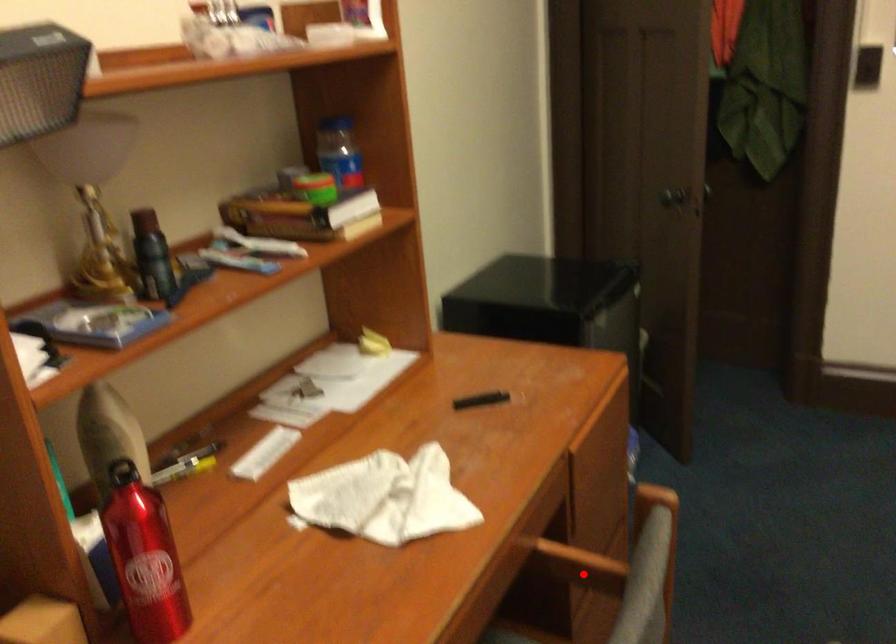
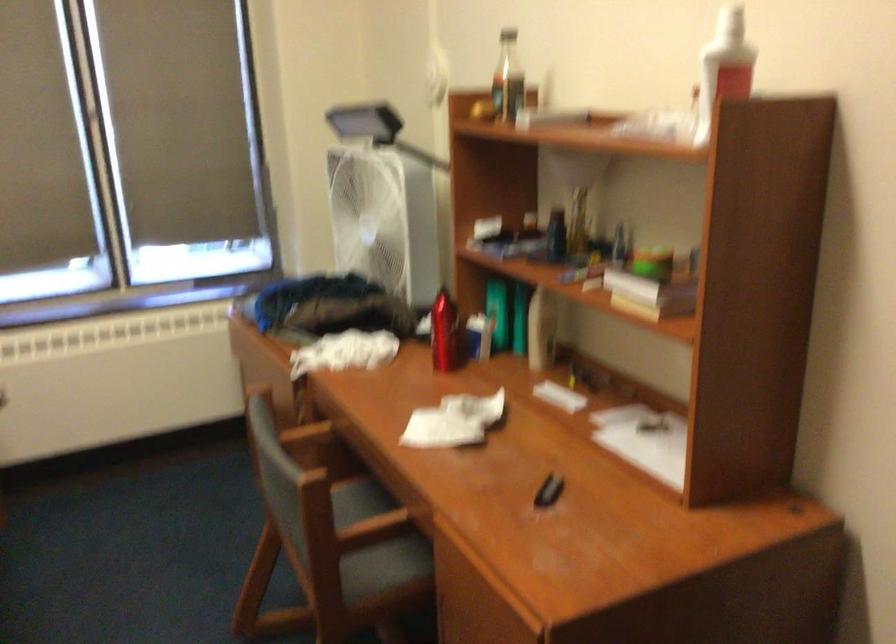
Locate, in the second image, the point that corresponds to the highlighted location in the first image.

(375, 545)